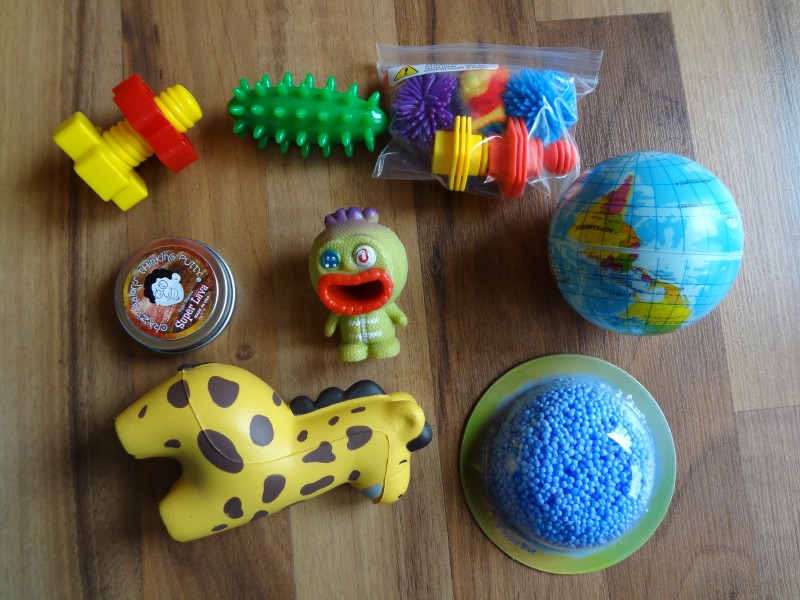
Locate an element on the screen. wood panels is located at coordinates (65, 456), (230, 210), (330, 189), (496, 300), (650, 92), (764, 144), (770, 464), (566, 9).